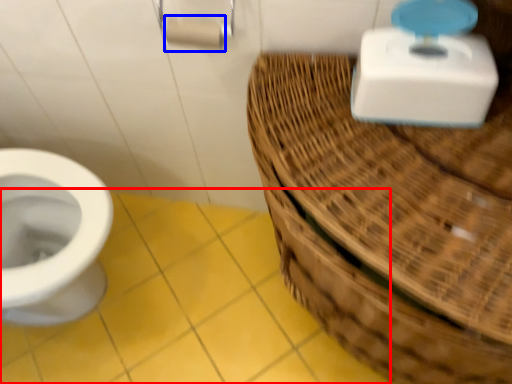
Question: Which of the following is the closest to the observer, ceramic tile (highlighted by a red box) or toilet paper (highlighted by a blue box)?

Choices:
 (A) ceramic tile
 (B) toilet paper

Answer: (B)